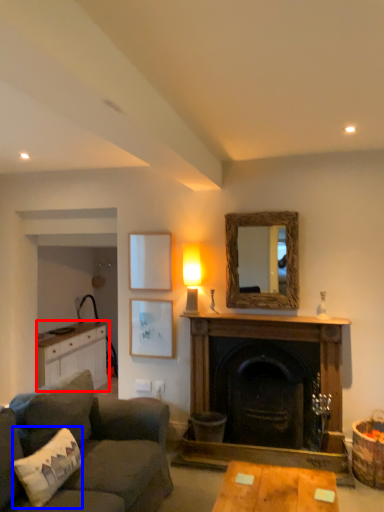
Question: Which of the following is the farthest to the observer, cabinetry (highlighted by a red box) or pillow (highlighted by a blue box)?

Choices:
 (A) cabinetry
 (B) pillow

Answer: (A)